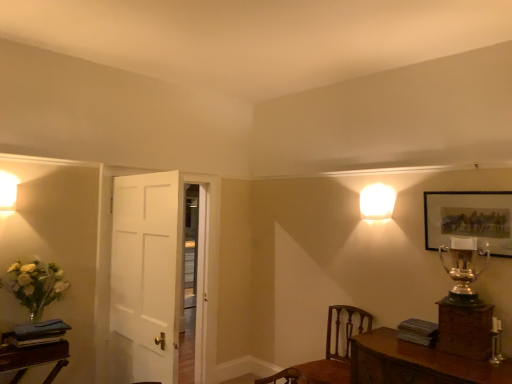
Where is `white wooden door at center`? The width and height of the screenshot is (512, 384). white wooden door at center is located at coordinates (151, 276).

What do you see at coordinates (35, 285) in the screenshot? Image resolution: width=512 pixels, height=384 pixels. I see `translucent glass vase at lower left` at bounding box center [35, 285].

What is the approximate height of matte gold picture frame at upper right?

matte gold picture frame at upper right is 17.24 inches in height.

The width and height of the screenshot is (512, 384). What do you see at coordinates (463, 269) in the screenshot?
I see `gold metallic trophy at upper right` at bounding box center [463, 269].

What do you see at coordinates (416, 363) in the screenshot?
I see `wooden table at lower right` at bounding box center [416, 363].

Locate an element on the screen. The height and width of the screenshot is (384, 512). white wooden door at center is located at coordinates (151, 276).

Is wooden table at lower right smaller than translucent glass vase at lower left?

Incorrect, wooden table at lower right is not smaller in size than translucent glass vase at lower left.

Find the location of a particular element. The width and height of the screenshot is (512, 384). floral arrangement above the wooden table at lower right (from the image's perspective) is located at coordinates (35, 285).

How much distance is there between wooden table at lower right and translucent glass vase at lower left?

7.83 feet.

Which object is positioned more to the left, wooden table at lower right or translucent glass vase at lower left?

From the viewer's perspective, translucent glass vase at lower left appears more on the left side.

This screenshot has width=512, height=384. Identify the location of the 2nd lamp in front of the white wooden door at center. (8, 191).

Which is behind, point (182, 194) or point (13, 178)?

Positioned behind is point (13, 178).

Considering the sizes of objects white wooden door at center and matte white sconce at upper left, the first lamp in the front-to-back sequence, in the image provided, who is thinner, white wooden door at center or matte white sconce at upper left, the first lamp in the front-to-back sequence,?

matte white sconce at upper left, the first lamp in the front-to-back sequence.

Considering the sizes of objects white wooden door at center and matte white sconce at upper left, arranged as the 2th lamp when viewed from the back, in the image provided, who is shorter, white wooden door at center or matte white sconce at upper left, arranged as the 2th lamp when viewed from the back,?

matte white sconce at upper left, arranged as the 2th lamp when viewed from the back.

Is brown wood chair at lower right a part of wooden table at lower right?

No, brown wood chair at lower right is located outside of wooden table at lower right.

From the picture: Between wooden table at lower right and brown wood chair at lower right, which one has less height?

With less height is wooden table at lower right.

Based on the photo, can you tell me how much wooden table at lower right and brown wood chair at lower right differ in facing direction?

0.0948 degrees.

Between white glossy square at upper right, acting as the 1th lamp starting from the back, and matte gold picture frame at upper right, which one is positioned behind?

white glossy square at upper right, acting as the 1th lamp starting from the back, is more distant.

From the picture: In terms of height, does white glossy square at upper right, the 2th lamp positioned from the left, look taller or shorter compared to matte gold picture frame at upper right?

Clearly, white glossy square at upper right, the 2th lamp positioned from the left, is shorter compared to matte gold picture frame at upper right.

Does white glossy square at upper right, which is counted as the 2th lamp, starting from the front, have a smaller size compared to matte gold picture frame at upper right?

Yes.

From a real-world perspective, is white glossy square at upper right, which is counted as the 2th lamp, starting from the front, below matte gold picture frame at upper right?

No, from a real-world perspective, white glossy square at upper right, which is counted as the 2th lamp, starting from the front, is not beneath matte gold picture frame at upper right.

Which object is thinner, brown wood chair at lower right or wooden table at lower right?

brown wood chair at lower right is thinner.

Considering the points (293, 369) and (439, 357), which point is in front, point (293, 369) or point (439, 357)?

The point (293, 369) is closer.

From the image's perspective, which one is positioned lower, brown wood chair at lower right or wooden table at lower right?

brown wood chair at lower right.

Can you confirm if brown wood chair at lower right is shorter than wooden table at lower right?

No.

Looking at this image, is wooden table at lower right placed right next to matte white sconce at upper left, arranged as the 2th lamp when viewed from the back?

wooden table at lower right is not next to matte white sconce at upper left, arranged as the 2th lamp when viewed from the back, and they're not touching.

From the image's perspective, which one is positioned higher, wooden table at lower right or matte white sconce at upper left, the first lamp in the front-to-back sequence?

From the image's view, matte white sconce at upper left, the first lamp in the front-to-back sequence, is above.

From a real-world perspective, relative to matte white sconce at upper left, the first lamp in the front-to-back sequence, is wooden table at lower right vertically above or below?

Clearly, from a real-world perspective, wooden table at lower right is below matte white sconce at upper left, the first lamp in the front-to-back sequence.

Is gold metallic trophy at upper right oriented away from white wooden door at center?

No, gold metallic trophy at upper right is not facing away from white wooden door at center.

Would you consider gold metallic trophy at upper right to be distant from white wooden door at center?

Yes, gold metallic trophy at upper right and white wooden door at center are quite far apart.

Between gold metallic trophy at upper right and white wooden door at center, which one appears on the right side from the viewer's perspective?

Positioned to the right is gold metallic trophy at upper right.

You are a GUI agent. You are given a task and a screenshot of the screen. Output one action in this format:
    pyautogui.click(x=<x>, y=<y>)
    Task: Click on the table on the right of translucent glass vase at lower left
    Image resolution: width=512 pixels, height=384 pixels.
    Given the screenshot: What is the action you would take?
    pyautogui.click(x=416, y=363)

Locate an element on the screen. lamp to the left of white wooden door at center is located at coordinates (8, 191).

Estimate the real-world distances between objects in this image. Which object is further from wooden table at lower right, brown wood chair at lower right or matte gold picture frame at upper right?

Based on the image, matte gold picture frame at upper right appears to be further to wooden table at lower right.

Which object lies nearer to the anchor point white glossy square at upper right, the 2th lamp positioned from the left, brown wood chair at lower right or white wooden door at center?

brown wood chair at lower right.

When comparing their distances from matte gold picture frame at upper right, does gold metallic trophy at upper right or matte white sconce at upper left, arranged as the 2th lamp when viewed from the back, seem further?

Among the two, matte white sconce at upper left, arranged as the 2th lamp when viewed from the back, is located further to matte gold picture frame at upper right.

Based on their spatial positions, is brown wood chair at lower right or wooden table at lower right further from white glossy square at upper right, which is the first lamp from right to left?

The object further to white glossy square at upper right, which is the first lamp from right to left, is wooden table at lower right.

Based on their spatial positions, is white wooden door at center or brown wood chair at lower right further from matte gold picture frame at upper right?

white wooden door at center is positioned further to the anchor matte gold picture frame at upper right.

Based on their spatial positions, is gold metallic trophy at upper right or white wooden door at center closer to wooden table at lower right?

gold metallic trophy at upper right is closer to wooden table at lower right.

Which object lies nearer to the anchor point white wooden door at center, matte gold picture frame at upper right or matte white sconce at upper left, the first lamp in the front-to-back sequence?

matte white sconce at upper left, the first lamp in the front-to-back sequence, is closer to white wooden door at center.

When comparing their distances from translucent glass vase at lower left, does white wooden door at center or wooden table at lower right seem further?

The object further to translucent glass vase at lower left is wooden table at lower right.

Where is `door situated between translucent glass vase at lower left and matte gold picture frame at upper right from left to right`? This screenshot has width=512, height=384. door situated between translucent glass vase at lower left and matte gold picture frame at upper right from left to right is located at coordinates (151, 276).

At what (x,y) coordinates should I click in order to perform the action: click on table located between translucent glass vase at lower left and gold metallic trophy at upper right in the left-right direction. Please return your answer as a coordinate pair (x, y). The width and height of the screenshot is (512, 384). Looking at the image, I should click on (416, 363).

The height and width of the screenshot is (384, 512). Identify the location of floral arrangement situated between matte white sconce at upper left, arranged as the 1th lamp when viewed from the left, and wooden table at lower right from left to right. (35, 285).

Where is `door located between translucent glass vase at lower left and white glossy square at upper right, the 2th lamp positioned from the left, in the left-right direction`? This screenshot has width=512, height=384. door located between translucent glass vase at lower left and white glossy square at upper right, the 2th lamp positioned from the left, in the left-right direction is located at coordinates (151, 276).